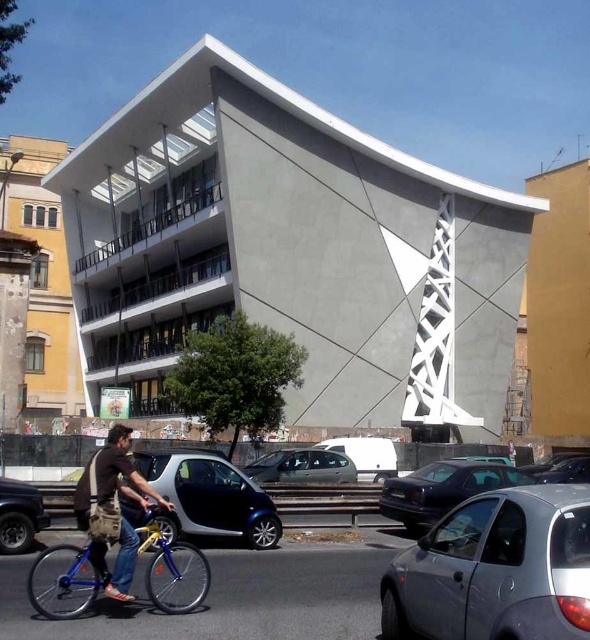
You are a pedestrian standing in front of the building and want to cross the road to reach the white geometric sculpture. There is a metallic blue car at center and a blue metallic bicycle at lower left in your path. Which object is closer to you, the pedestrian, so you need to avoid it first?

The blue metallic bicycle at lower left is closer to you because the metallic blue car at center is above it, meaning the bicycle is positioned lower and nearer in the scene.

You are standing at a viewpoint where you can see both points labeled as point (392, 477) and point (34, 506). Based on their positions, which point is closer to you?

Point (34, 506) is closer to you because it is in front of point (392, 477).

You are standing in front of the modern architectural structure and want to take a photo that includes both point (192, 472) and point (168, 602). Which point will appear closer to the bottom of the photo?

Point (168, 602) will appear closer to the bottom of the photo because it is closer to the camera than point (192, 472).